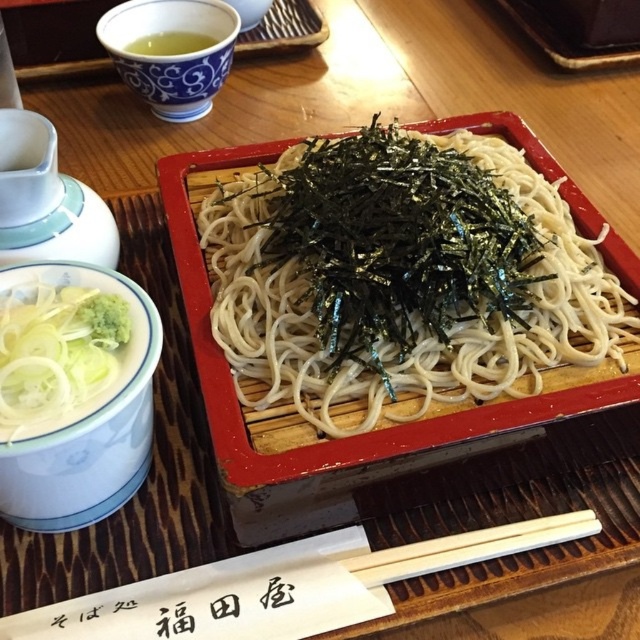
Can you confirm if white wood chopsticks at lower center is smaller than green liquid at upper left?

No.

Between white wood chopsticks at lower center and green liquid at upper left, which one has less height?

Standing shorter between the two is white wood chopsticks at lower center.

Does point (436, 554) come farther from viewer compared to point (188, 52)?

No, it is in front of (188, 52).

The width and height of the screenshot is (640, 640). I want to click on white wood chopsticks at lower center, so tap(468, 547).

Is white wood chopsticks at center below white translucent noodles at left?

Yes, white wood chopsticks at center is below white translucent noodles at left.

Which is behind, point (317, 556) or point (100, 371)?

Positioned behind is point (317, 556).

What are the coordinates of `white wood chopsticks at center` in the screenshot? It's located at (280, 588).

Does white wood chopsticks at center have a lesser width compared to white wood chopsticks at lower center?

In fact, white wood chopsticks at center might be wider than white wood chopsticks at lower center.

Between white wood chopsticks at center and white wood chopsticks at lower center, which one appears on the left side from the viewer's perspective?

From the viewer's perspective, white wood chopsticks at center appears more on the left side.

The width and height of the screenshot is (640, 640). Find the location of `white wood chopsticks at center`. white wood chopsticks at center is located at coordinates (280, 588).

This screenshot has height=640, width=640. In order to click on white wood chopsticks at center in this screenshot , I will do `click(280, 588)`.